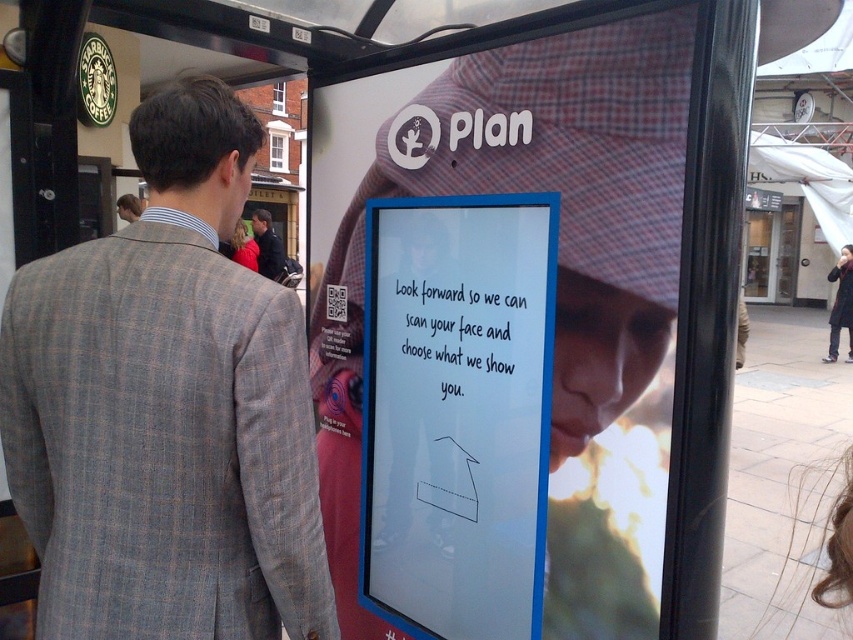
You are a security guard at the bus stop. You need to ensure that the QR code on the advertisement is visible to the public. Considering the positions of the gray checkered suit at left and brown hair at lower right, which object might be blocking the QR code?

The gray checkered suit at left is taller than brown hair at lower right, so the gray checkered suit at left might be blocking the QR code.

Consider the image. You are at a bus stop and need to decide which jacket to wear for a quick photo. The dark blue jacket at center and the red fleece jacket at center are both options. Which jacket would appear larger in the photo?

The dark blue jacket at center is bigger than the red fleece jacket at center, so it would appear larger in the photo.

You are standing at the bus stop and want to scan the QR code on the advertisement. The QR code is located at point (469, 429). If you can reach up to 6 feet, can you reach the QR code?

The distance of point (469, 429) from viewer is 6.48 feet, so you cannot reach the QR code since it is slightly further than your maximum reach of 6 feet.